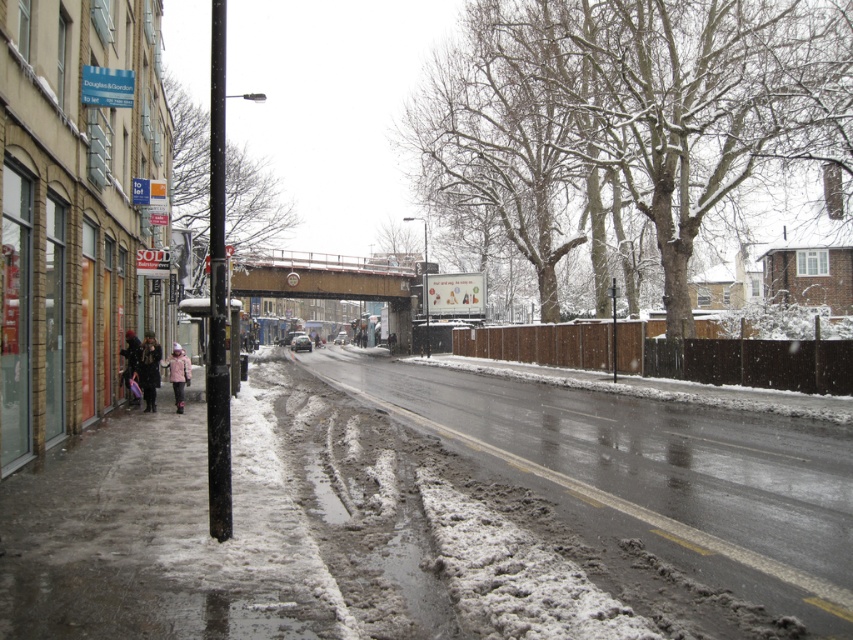
Is point (346, 272) in front of point (86, 99)?

No.

Can you confirm if brown wooden bridge at center is positioned to the left of blue plastic sign at upper left?

Indeed, brown wooden bridge at center is positioned on the left side of blue plastic sign at upper left.

Is point (335, 269) less distant than point (86, 81)?

No, (335, 269) is further to viewer.

The height and width of the screenshot is (640, 853). I want to click on brown wooden bridge at center, so click(318, 275).

Who is shorter, snowy concrete sidewalk at lower left or dark brown coat at lower left?

With less height is snowy concrete sidewalk at lower left.

Where is `snowy concrete sidewalk at lower left`? The image size is (853, 640). snowy concrete sidewalk at lower left is located at coordinates (415, 509).

Between blue plastic sign at upper left and dark brown coat at lower left, which one has more height?

dark brown coat at lower left

How distant is blue plastic sign at upper left from dark brown coat at lower left?

blue plastic sign at upper left is 5.66 meters away from dark brown coat at lower left.

What do you see at coordinates (106, 86) in the screenshot? The image size is (853, 640). I see `blue plastic sign at upper left` at bounding box center [106, 86].

At what (x,y) coordinates should I click in order to perform the action: click on blue plastic sign at upper left. Please return your answer as a coordinate pair (x, y). The height and width of the screenshot is (640, 853). Looking at the image, I should click on (106, 86).